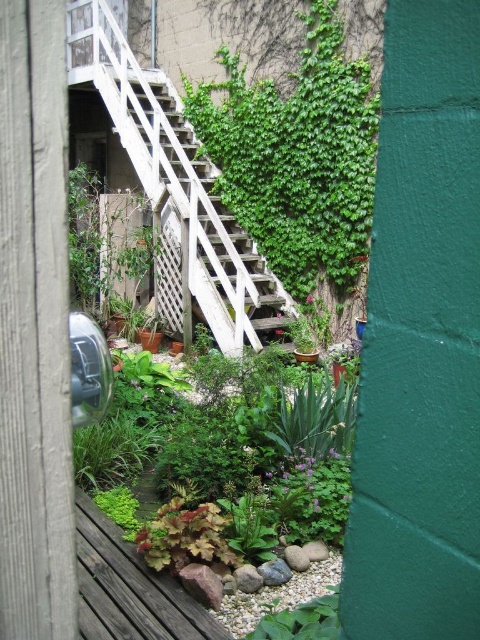
You are standing in front of the garden door and want to reach the wooden stairs at center. Which direction should you move relative to the leathery green leaf at center?

You should move to the left of the leathery green leaf at center to reach the wooden stairs at center, as the wooden stairs at center are located to the left of the leathery green leaf at center.

You are standing in front of the garden door and want to locate the wooden stairs at center. According to the coordinates provided, where exactly should you look to find them?

The wooden stairs at center are located at the coordinates point (193, 208).

You are standing at the base of the wooden stairs at center and want to pick up the leathery green leaf at center. Which direction should you move to reach the leaf?

The wooden stairs at center is located above the leathery green leaf at center, so you should move downward to reach the leaf.